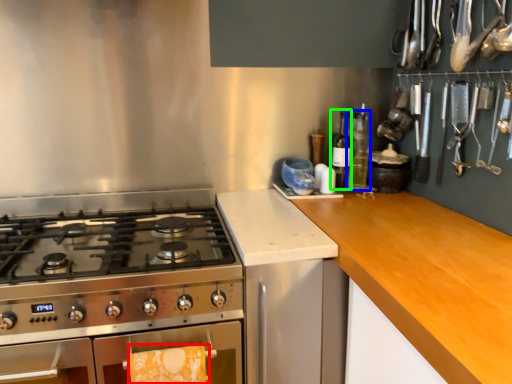
Question: Estimate the real-world distances between objects in this image. Which object is closer to hand towel (highlighted by a red box), bottle (highlighted by a blue box) or bottle (highlighted by a green box)?

Choices:
 (A) bottle
 (B) bottle

Answer: (B)